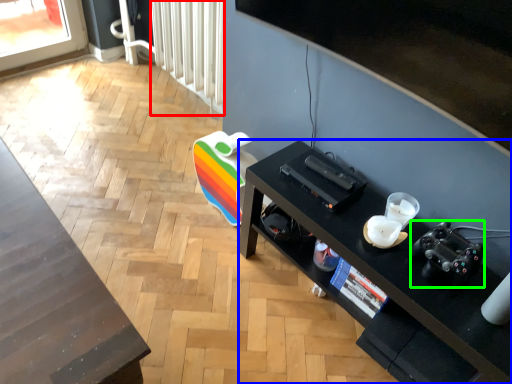
Question: Estimate the real-world distances between objects in this image. Which object is farther from radiator (highlighted by a red box), desk (highlighted by a blue box) or video camera (highlighted by a green box)?

Choices:
 (A) desk
 (B) video camera

Answer: (B)